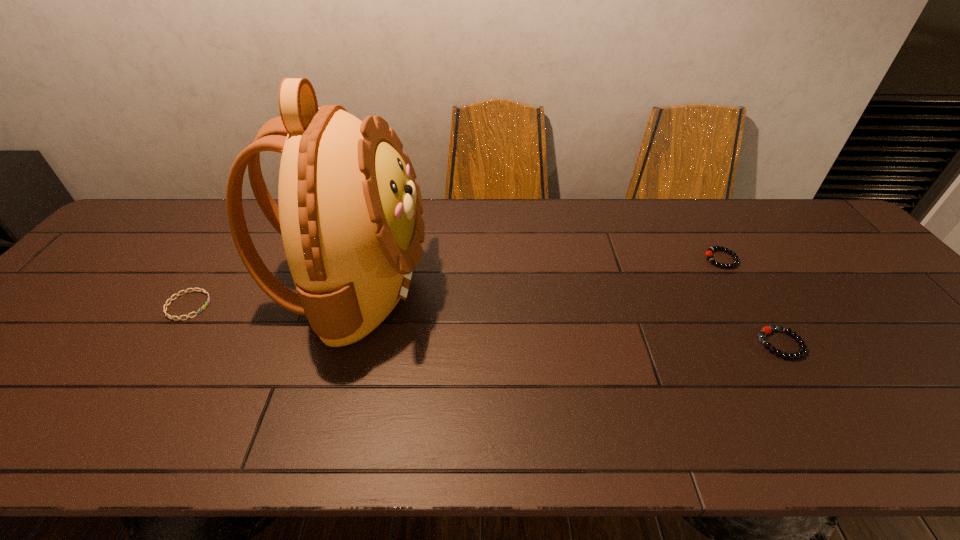
Where is `the tallest object`? the tallest object is located at coordinates (349, 213).

This screenshot has height=540, width=960. Find the location of `backpack`. backpack is located at coordinates (349, 213).

You are a GUI agent. You are given a task and a screenshot of the screen. Output one action in this format:
    pyautogui.click(x=<x>, y=<y>)
    Task: Click on the nearest bracelet
    This screenshot has width=960, height=540.
    Given the screenshot: What is the action you would take?
    pyautogui.click(x=765, y=330)

Where is `the farthest bracelet`? The image size is (960, 540). the farthest bracelet is located at coordinates (709, 251).

In order to click on the second nearest bracelet in this screenshot , I will do `click(202, 290)`.

The image size is (960, 540). What are the coordinates of `the leftmost bracelet` in the screenshot? It's located at (202, 290).

This screenshot has height=540, width=960. Identify the location of vacant space located 0.220m on the front-facing side of the backpack. (510, 287).

You are a GUI agent. You are given a task and a screenshot of the screen. Output one action in this format:
    pyautogui.click(x=<x>, y=<y>)
    Task: Click on the vacant point located on the left of the nearest bracelet
    This screenshot has height=540, width=960.
    Given the screenshot: What is the action you would take?
    pyautogui.click(x=597, y=344)

Where is `vacant space located on the front of the farthest bracelet`? The image size is (960, 540). vacant space located on the front of the farthest bracelet is located at coordinates (747, 301).

Locate an element on the screen. vacant space located 0.160m on the surface of the second nearest bracelet showing star-shaped elements is located at coordinates (272, 306).